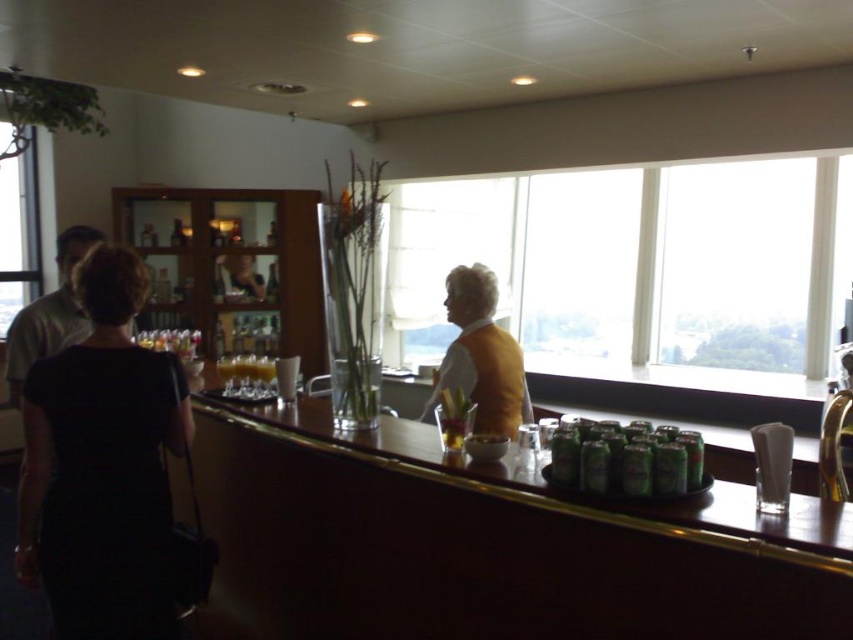
Between transparent glass window at upper center and black dress at left, which one is positioned higher?

Positioned higher is transparent glass window at upper center.

Which is more to the right, transparent glass window at upper center or black dress at left?

transparent glass window at upper center is more to the right.

Is point (827, 326) behind point (141, 355)?

Yes, point (827, 326) is behind point (141, 355).

Locate an element on the screen. This screenshot has height=640, width=853. transparent glass window at upper center is located at coordinates (637, 269).

Can you confirm if transparent glass window at upper center is thinner than orange fabric vest at center?

No, transparent glass window at upper center is not thinner than orange fabric vest at center.

Is point (755, 333) behind point (466, 394)?

Yes.

Is point (556, 292) positioned behind point (495, 413)?

Yes, point (556, 292) is behind point (495, 413).

The image size is (853, 640). Find the location of `transparent glass window at upper center`. transparent glass window at upper center is located at coordinates (637, 269).

Is black dress at left to the left of translucent glass cup at bar from the viewer's perspective?

Indeed, black dress at left is positioned on the left side of translucent glass cup at bar.

How much distance is there between black dress at left and translucent glass cup at bar?

black dress at left is 35.64 inches away from translucent glass cup at bar.

Measure the distance between point (149, 579) and camera.

Point (149, 579) is 6.85 feet from camera.

Identify the location of black dress at left. This screenshot has height=640, width=853. (102, 465).